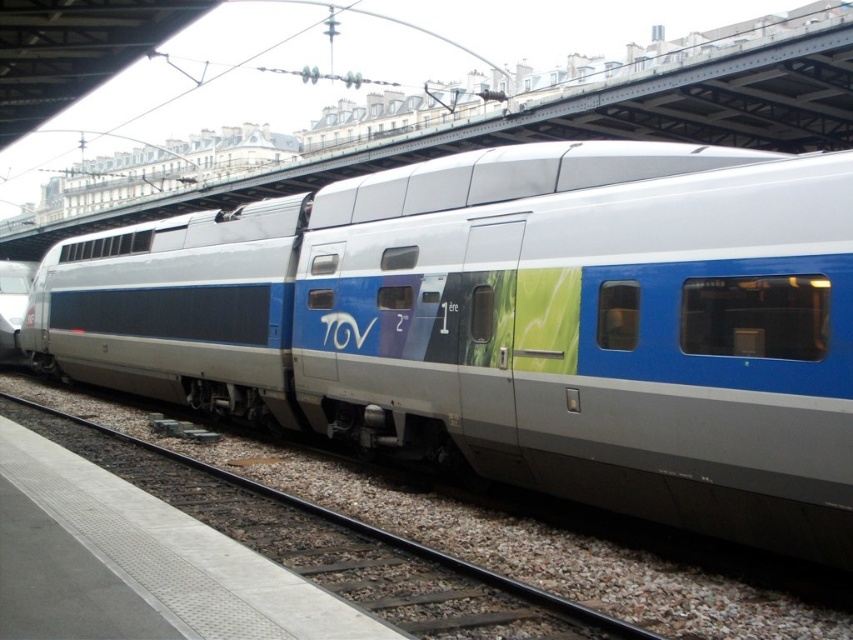
You are a photographer standing at the station platform. You want to take a photo of the silver metallic train at center. If your camera can focus on objects up to 5 meters away, will it be able to capture the train clearly?

The silver metallic train at center is 5.24 meters away from the camera. Since the camera can only focus up to 5 meters, it will not be able to capture the train clearly.